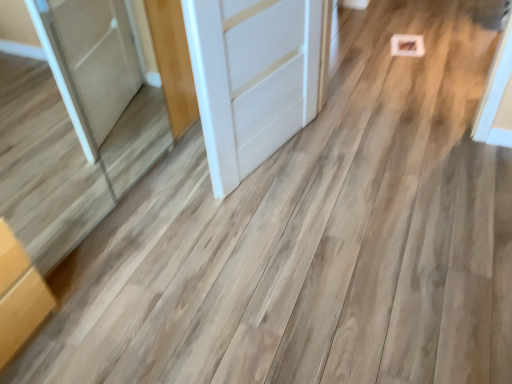
What is the approximate height of white matte door at center?

35.21 inches.

Image resolution: width=512 pixels, height=384 pixels. What do you see at coordinates (254, 77) in the screenshot?
I see `white matte door at center` at bounding box center [254, 77].

You are a GUI agent. You are given a task and a screenshot of the screen. Output one action in this format:
    pyautogui.click(x=<x>, y=<y>)
    Task: Click on the white matte door at center
    This screenshot has width=512, height=384.
    Given the screenshot: What is the action you would take?
    pyautogui.click(x=254, y=77)

At what (x,y) coordinates should I click in order to perform the action: click on white matte door at center. Please return your answer as a coordinate pair (x, y). This screenshot has height=384, width=512. Looking at the image, I should click on (254, 77).